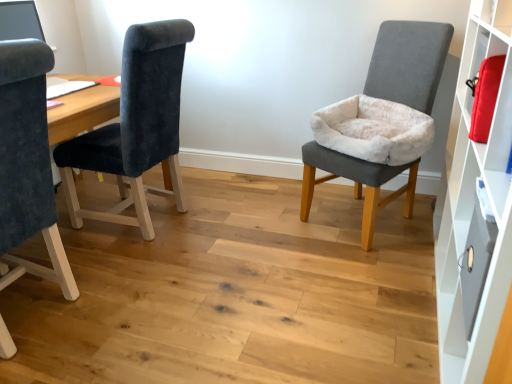
Image resolution: width=512 pixels, height=384 pixels. Find the location of `free space in front of velvet gray chair at right, acting as the third chair starting from the left`. free space in front of velvet gray chair at right, acting as the third chair starting from the left is located at coordinates click(371, 272).